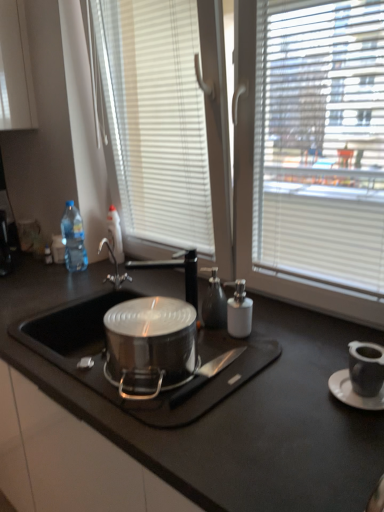
Identify the location of free spot in front of transparent plastic bottle at left, the 1th bottle positioned from the left. (67, 283).